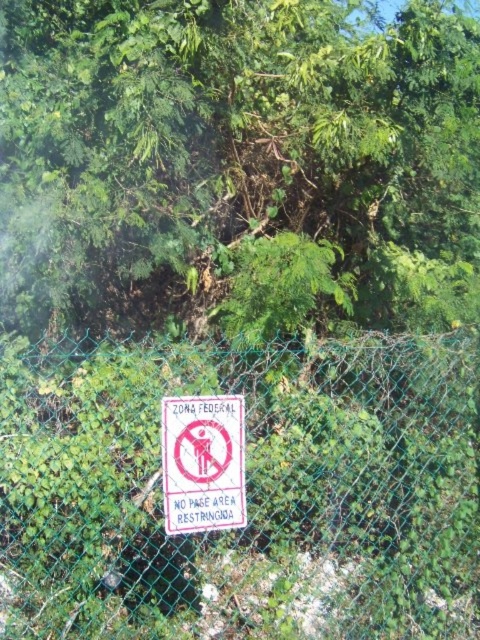
Between green mesh fence at center and white paper sign at center, which one appears on the left side from the viewer's perspective?

Positioned to the left is white paper sign at center.

Image resolution: width=480 pixels, height=640 pixels. Describe the element at coordinates (240, 490) in the screenshot. I see `green mesh fence at center` at that location.

The width and height of the screenshot is (480, 640). What are the coordinates of `green mesh fence at center` in the screenshot? It's located at (240, 490).

Can you confirm if green leafy tree at center is smaller than white paper sign at center?

No, green leafy tree at center is not smaller than white paper sign at center.

Between green leafy tree at center and white paper sign at center, which one appears on the left side from the viewer's perspective?

white paper sign at center

Which is behind, point (118, 90) or point (175, 467)?

The point (118, 90) is more distant.

At what (x,y) coordinates should I click in order to perform the action: click on green leafy tree at center. Please return your answer as a coordinate pair (x, y). This screenshot has height=640, width=480. Looking at the image, I should click on (238, 163).

Can you confirm if green leafy tree at center is positioned to the left of green mesh fence at center?

In fact, green leafy tree at center is to the right of green mesh fence at center.

Measure the distance between green leafy tree at center and camera.

green leafy tree at center is 2.89 meters away from camera.

I want to click on green leafy tree at center, so click(x=238, y=163).

Where is `green leafy tree at center`? The image size is (480, 640). green leafy tree at center is located at coordinates (238, 163).